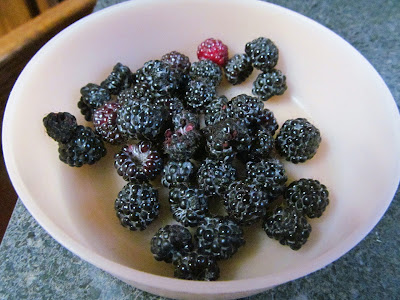
Locate an element on the screen. The height and width of the screenshot is (300, 400). inside of white bowl is located at coordinates (186, 26).